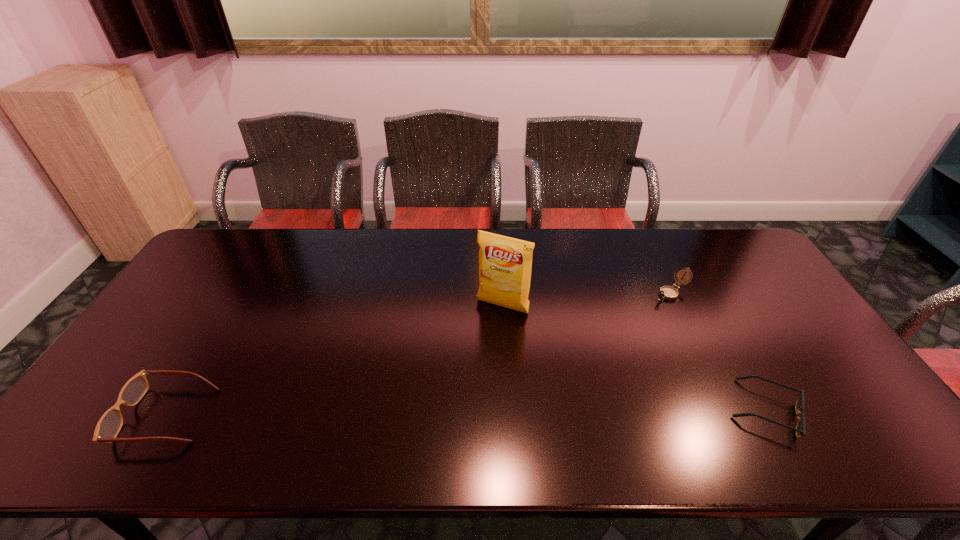
Image resolution: width=960 pixels, height=540 pixels. I want to click on vacant space at the near edge, so click(222, 402).

In the image, there is a desktop. Find the location of `blank space at the left edge`. blank space at the left edge is located at coordinates [x=207, y=321].

Where is `vacant position at the right edge of the desktop`? This screenshot has height=540, width=960. vacant position at the right edge of the desktop is located at coordinates (769, 295).

The image size is (960, 540). In the image, there is a desktop. In order to click on free space at the near left corner in this screenshot , I will do `click(140, 421)`.

Where is `vacant space that is in between the shortest object and the spectacles`? vacant space that is in between the shortest object and the spectacles is located at coordinates (466, 413).

Identify the location of vacant area between the spectacles and the shortest object. This screenshot has height=540, width=960. (466, 413).

Locate an element on the screen. The width and height of the screenshot is (960, 540). unoccupied area between the spectacles and the sunglasses is located at coordinates (466, 413).

Where is `free space between the third tallest object and the crisp (potato chip)`? free space between the third tallest object and the crisp (potato chip) is located at coordinates (334, 361).

Locate an element on the screen. vacant space that is in between the leftmost object and the second tallest object is located at coordinates (419, 354).

At what (x,y) coordinates should I click in order to perform the action: click on empty location between the spectacles and the tallest object. Please return your answer as a coordinate pair (x, y). Looking at the image, I should click on (334, 361).